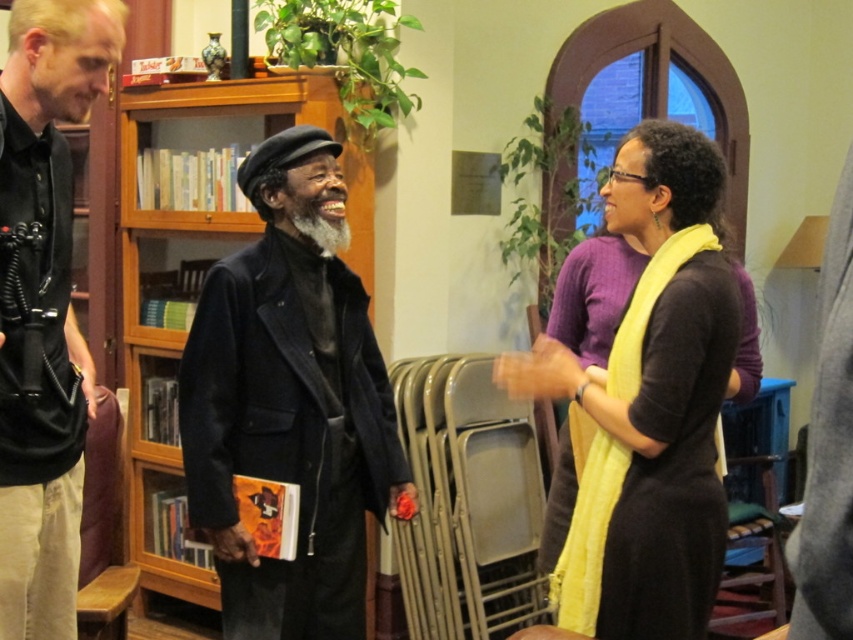
Does matte black jacket at center come behind wooden at left?

No.

Is matte black jacket at center wider than wooden at left?

Indeed, matte black jacket at center has a greater width compared to wooden at left.

Between point (334, 502) and point (93, 541), which one is positioned behind?

The point (93, 541) is more distant.

What are the coordinates of `matte black jacket at center` in the screenshot? It's located at click(x=289, y=401).

Measure the distance from matte black jacket at center to black leather jacket at left.

A distance of 18.18 inches exists between matte black jacket at center and black leather jacket at left.

Can you confirm if matte black jacket at center is shorter than black leather jacket at left?

Correct, matte black jacket at center is not as tall as black leather jacket at left.

The height and width of the screenshot is (640, 853). What do you see at coordinates (289, 401) in the screenshot?
I see `matte black jacket at center` at bounding box center [289, 401].

Identify the location of matte black jacket at center. (289, 401).

Is matte black jacket at center thinner than dark purple sweater at center?

No, matte black jacket at center is not thinner than dark purple sweater at center.

Which is behind, point (315, 186) or point (613, 545)?

Point (315, 186)

Where is `matte black jacket at center`? The image size is (853, 640). matte black jacket at center is located at coordinates tap(289, 401).